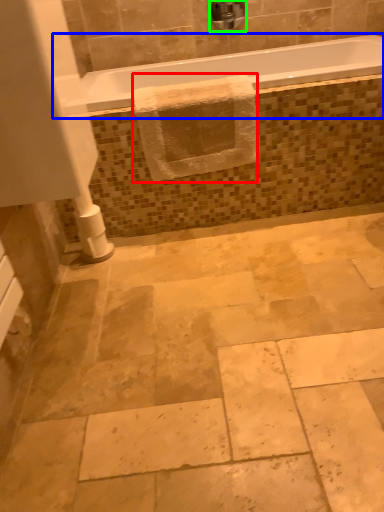
Question: Which object is positioned farthest from bath towel (highlighted by a red box)? Select from bathtub (highlighted by a blue box) and faucet (highlighted by a green box).

Choices:
 (A) bathtub
 (B) faucet

Answer: (B)